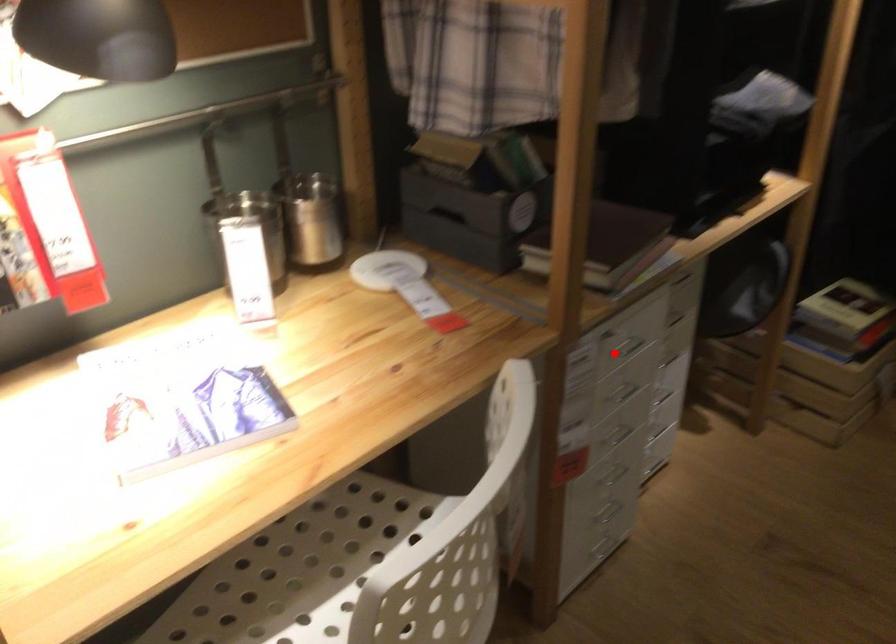
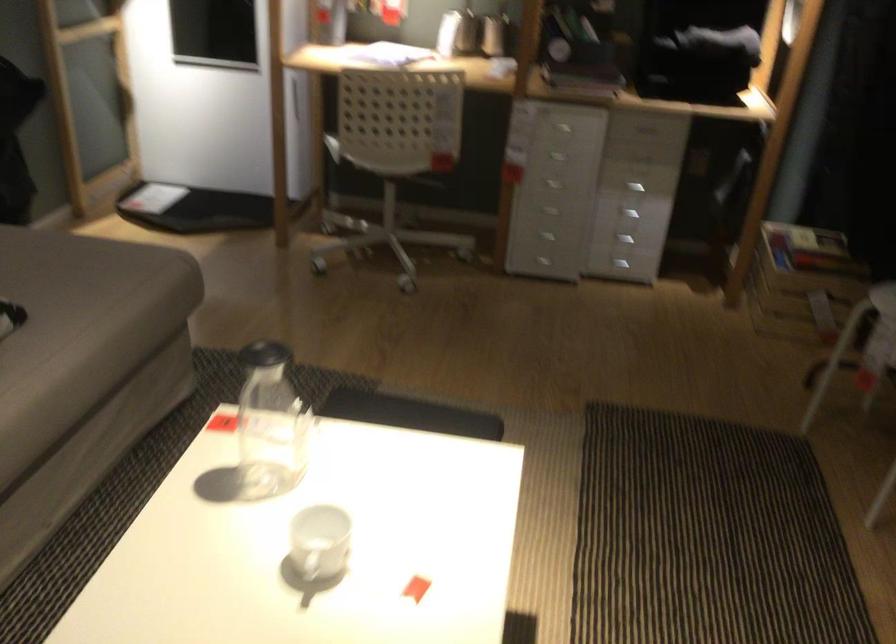
Question: I am providing you with two images of the same scene from different viewpoints. A red point is marked on the first image. Is the red point's position out of view in image 2?

Choices:
 (A) Yes
 (B) No

Answer: (B)